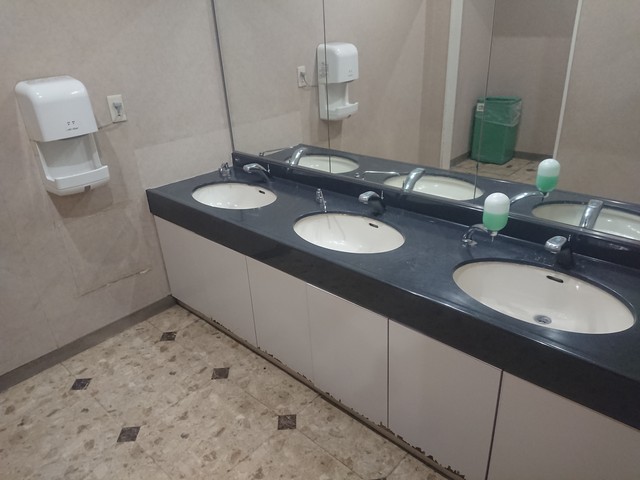
Locate an element on the screen. mirror is located at coordinates (420, 84).